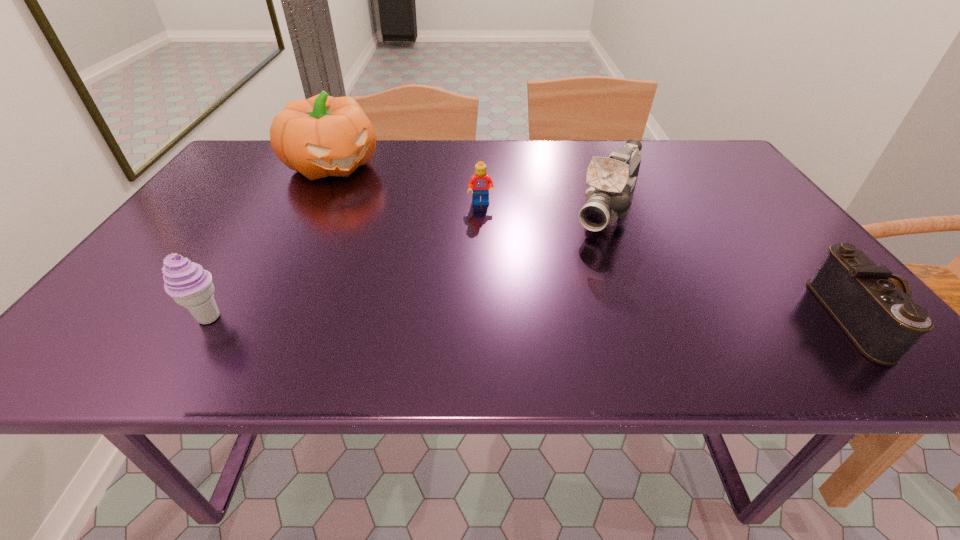
At what (x,y) coordinates should I click in order to perform the action: click on vacant area situated 0.360m on the carved face of the pumpkin. Please return your answer as a coordinate pair (x, y). The width and height of the screenshot is (960, 540). Looking at the image, I should click on (424, 249).

Identify the location of vacant space located 0.100m on the carved face of the pumpkin. The image size is (960, 540). (372, 200).

At what (x,y) coordinates should I click in order to perform the action: click on vacant area located 0.060m on the front-facing side of the camcorder. Please return your answer as a coordinate pair (x, y). Looking at the image, I should click on (588, 252).

The height and width of the screenshot is (540, 960). In order to click on vacant region located on the front-facing side of the camcorder in this screenshot , I will do `click(584, 260)`.

Identify the location of free location located 0.060m on the front-facing side of the camcorder. The height and width of the screenshot is (540, 960). (588, 252).

I want to click on object that is at the far edge, so click(x=321, y=136).

Identify the location of icecream that is at the near edge. (190, 286).

You are a GUI agent. You are given a task and a screenshot of the screen. Output one action in this format:
    pyautogui.click(x=<x>, y=<y>)
    Task: Click on the camera that is positioned at the near edge
    Image resolution: width=960 pixels, height=540 pixels.
    Given the screenshot: What is the action you would take?
    pyautogui.click(x=874, y=308)

Where is `object that is at the right edge`? object that is at the right edge is located at coordinates (874, 308).

This screenshot has height=540, width=960. What are the coordinates of `object that is at the near right corner` in the screenshot? It's located at (874, 308).